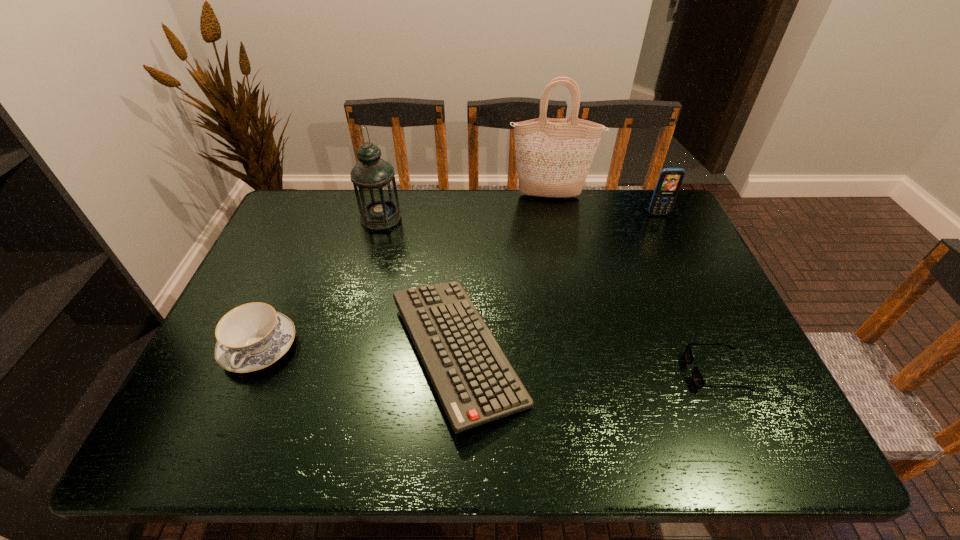
Select which object appears as the second closest to the shortest object. Please provide its 2D coordinates. Your answer should be formatted as a tuple, i.e. [(x, y)], where the tuple contains the x and y coordinates of a point satisfying the conditions above.

[(669, 181)]